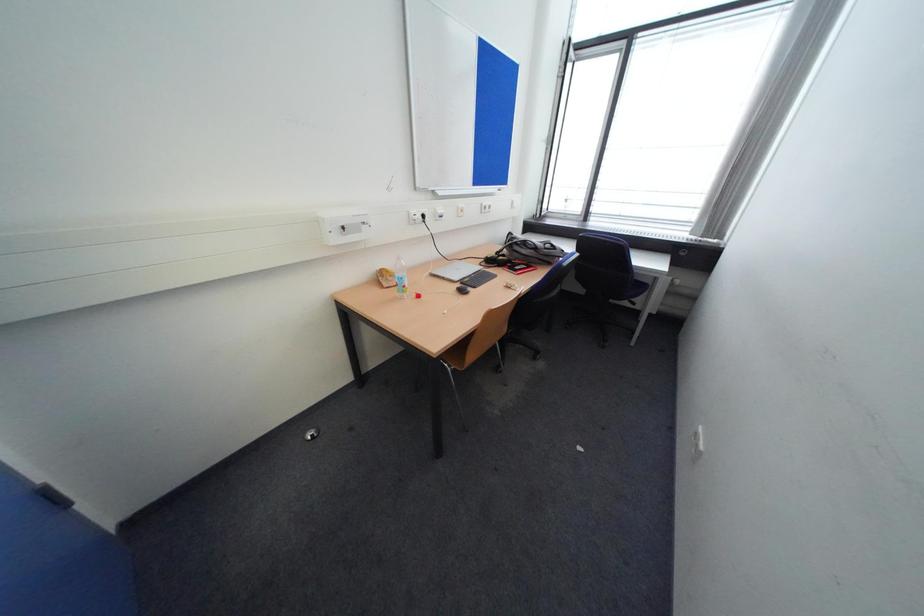
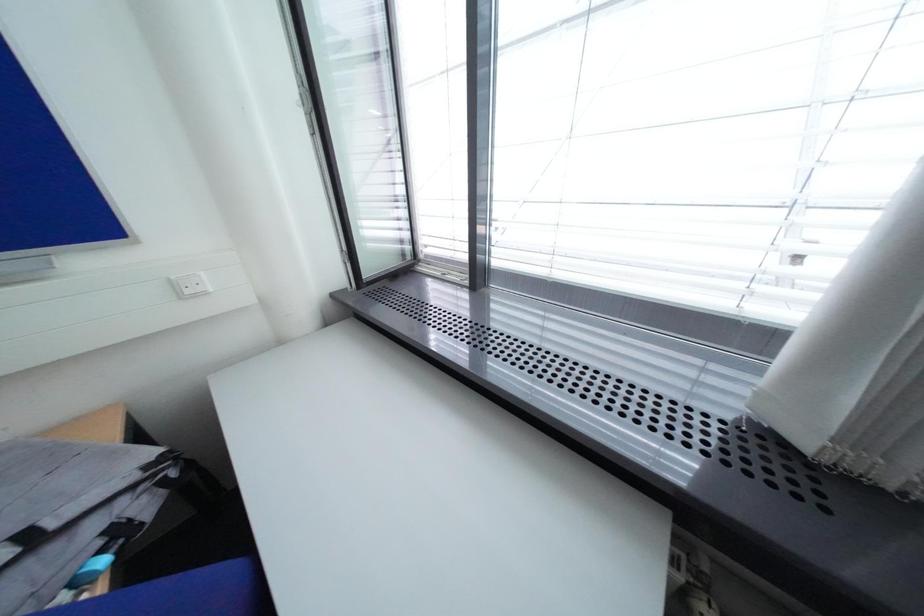
What movement of the cameraman would produce the second image?

The cameraman moved toward right, forward.